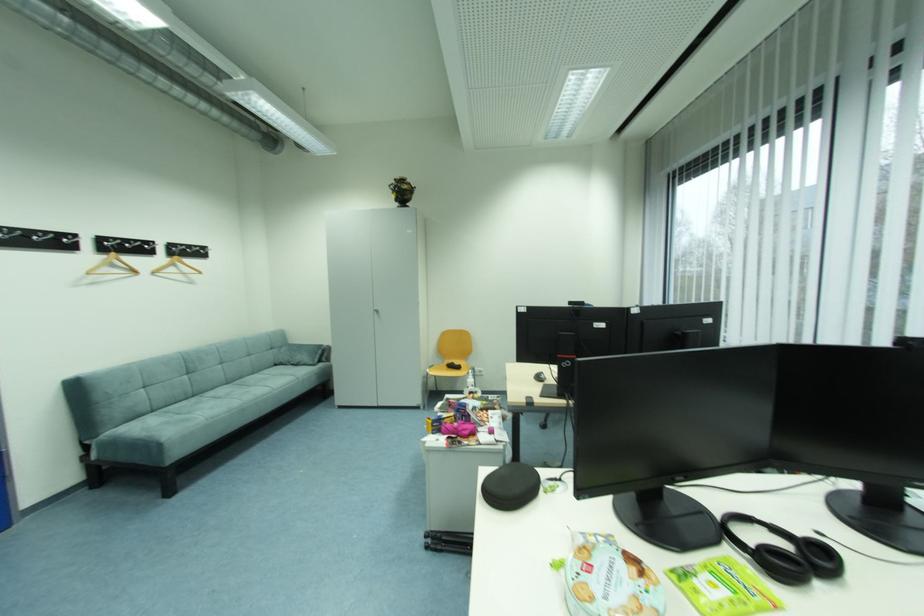
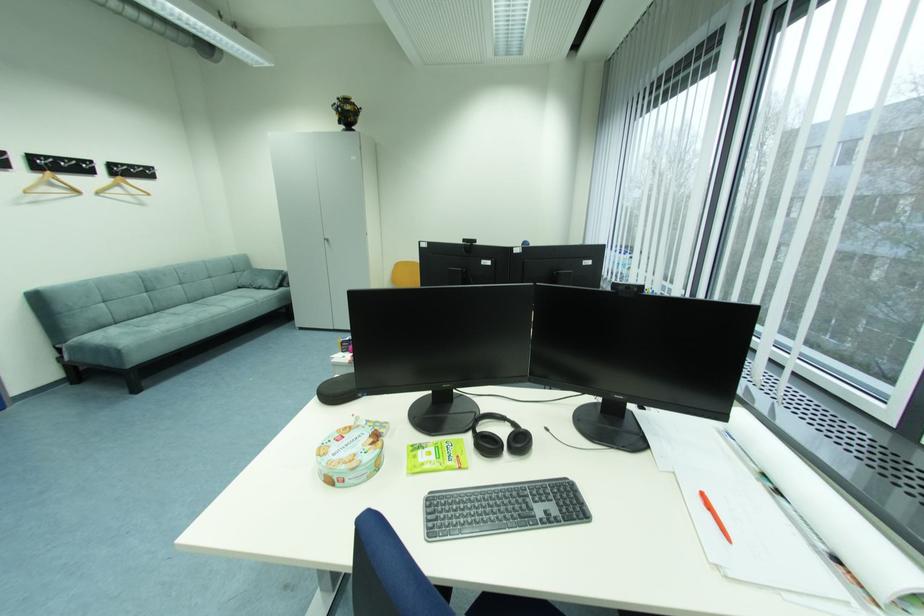
In the second image, find the point that corresponds to pixel 283 367 in the first image.

(246, 288)